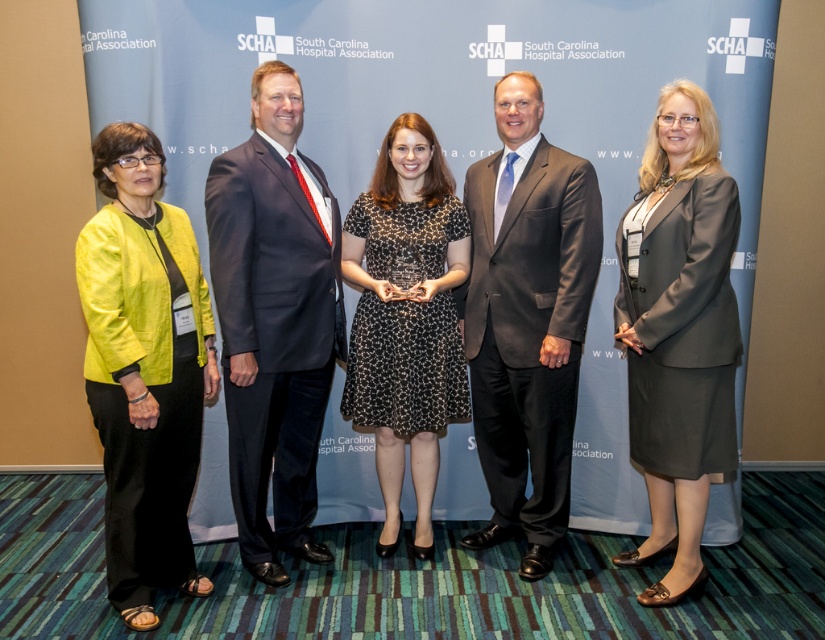
Question: Estimate the real-world distances between objects in this image. Which object is closer to the dark gray suit at center?

Choices:
 (A) matte gray suit at right
 (B) black dotted dress at center

Answer: (B)

Question: Which of the following is the closest to the observer?

Choices:
 (A) (384, 496)
 (B) (498, 150)

Answer: (B)

Question: Can you confirm if dark blue suit at center is smaller than matte yellow blazer at left?

Choices:
 (A) no
 (B) yes

Answer: (A)

Question: Can you confirm if dark gray suit at center is wider than black dotted dress at center?

Choices:
 (A) no
 (B) yes

Answer: (B)

Question: Is matte yellow blazer at left below matte gray suit at right?

Choices:
 (A) yes
 (B) no

Answer: (A)

Question: Which point appears farthest from the camera in this image?

Choices:
 (A) (475, 412)
 (B) (248, 205)

Answer: (A)